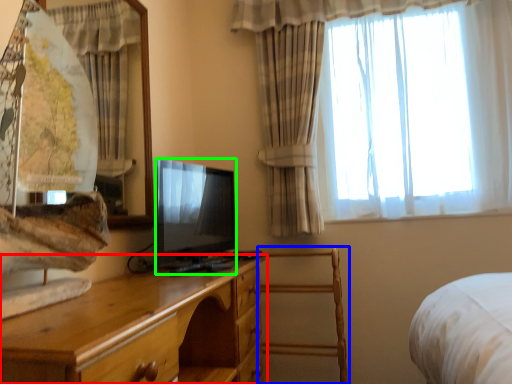
Question: Considering the real-world distances, which object is closest to chest of drawers (highlighted by a red box)? armchair (highlighted by a blue box) or television (highlighted by a green box).

Choices:
 (A) armchair
 (B) television

Answer: (B)